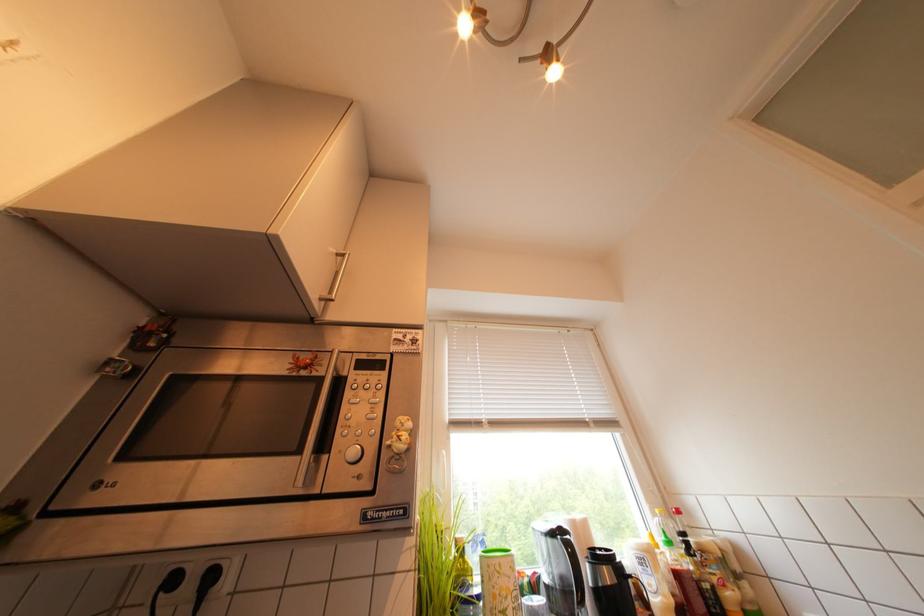
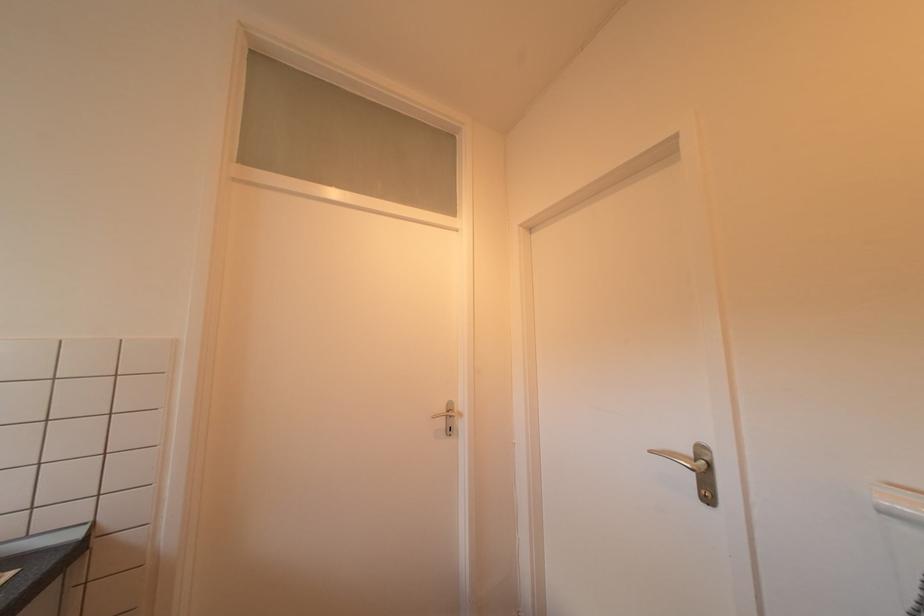
First-person continuous shooting, in which direction is the camera rotating?

The camera rotated toward right-up.